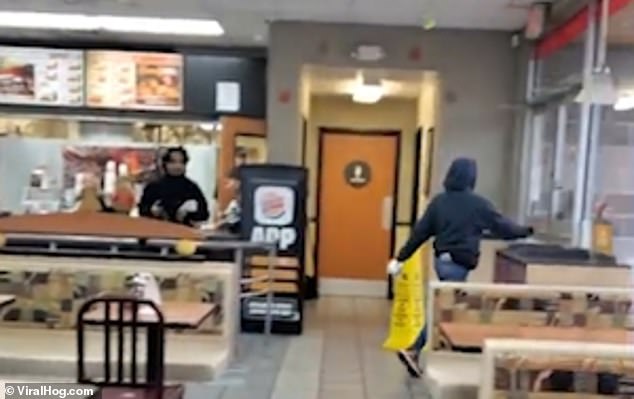
Identify the location of tiles. (307, 373), (346, 374), (387, 391).